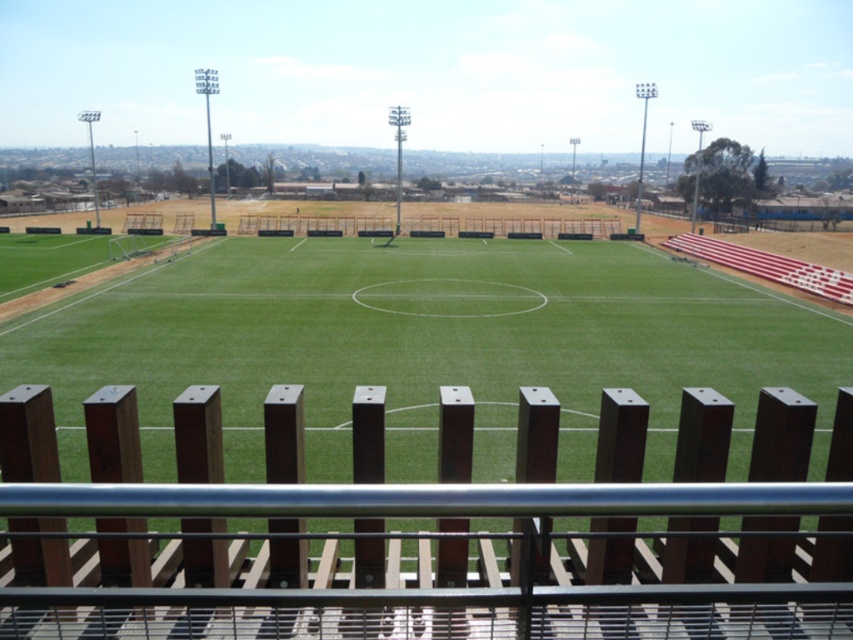
You are a soccer player standing on the green grass football field at center and want to kick a ball towards the brown wooden fence at center. Considering their sizes, which object will the ball hit first?

The ball will hit the brown wooden fence at center first because it is smaller in size compared to the green grass football field at center, making it closer to the player.

You are standing at the center of the soccer field and want to exit the field through the nearest fence. Which direction should you walk to reach the brown wooden fence at center?

The brown wooden fence at center is located at point (418, 534), so you should walk towards the center of the field to reach it.